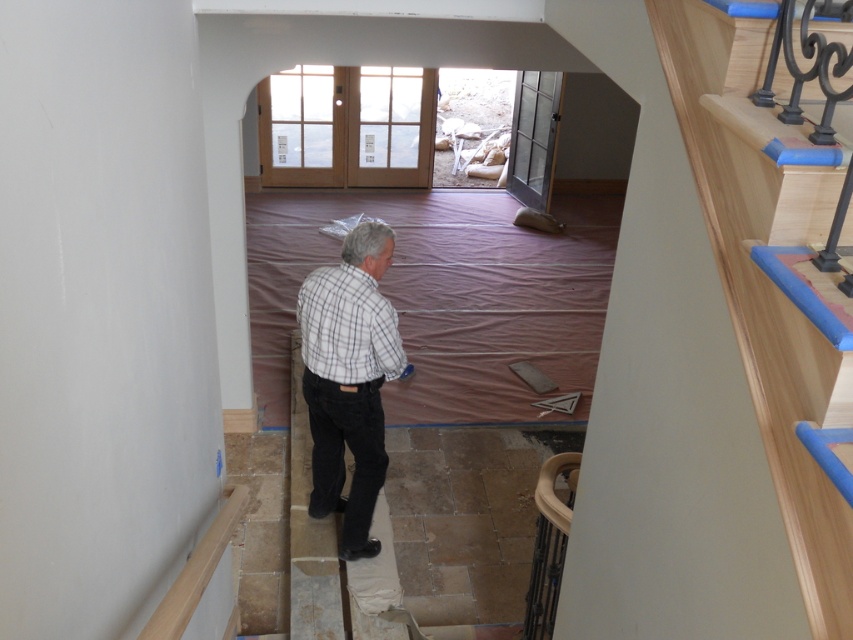
You are a construction worker who needs to choose a shirt to wear for the day. You see a white checkered shirt at center and a plaid cotton shirt at center. Which shirt would be more suitable for covering your upper body if you want to ensure maximum coverage?

The white checkered shirt at center has a larger size compared to plaid cotton shirt at center, so it would provide more coverage for your upper body.

You are standing at the top of the staircase in the house under renovation. You see a point marked at coordinates (347,380). What object or person is located at that point?

The point at coordinates (347,380) marks the location of the white checkered shirt at center.

You are a construction worker standing at the top of the staircase in the image. You notice two points marked on the floor below. Which point is closer to you, point (387, 353) or point (311, 355)?

Point (387, 353) is closer to you than point (311, 355) because it is nearer to the camera position.